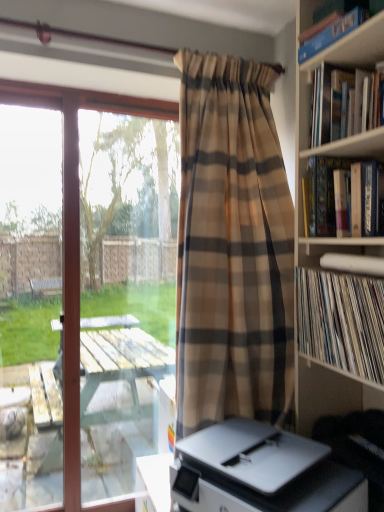
Question: Can you see transparent glass window at left touching white vinyl records at right, which is the first book in bottom-to-top order?

Choices:
 (A) yes
 (B) no

Answer: (B)

Question: Can you confirm if transparent glass window at left is thinner than white vinyl records at right, marked as the 4th book in a top-to-bottom arrangement?

Choices:
 (A) yes
 (B) no

Answer: (A)

Question: From a real-world perspective, is transparent glass window at left located beneath white vinyl records at right, which is the first book in bottom-to-top order?

Choices:
 (A) yes
 (B) no

Answer: (A)

Question: From the image's perspective, is transparent glass window at left over white vinyl records at right, which is the first book in bottom-to-top order?

Choices:
 (A) no
 (B) yes

Answer: (A)

Question: From a real-world perspective, is transparent glass window at left on white vinyl records at right, which is the first book in bottom-to-top order?

Choices:
 (A) no
 (B) yes

Answer: (A)

Question: From the image's perspective, is blue hardcover book at upper right, the 1th book positioned from the top, located above or below white vinyl records at right, marked as the 4th book in a top-to-bottom arrangement?

Choices:
 (A) above
 (B) below

Answer: (A)

Question: In terms of width, does blue hardcover book at upper right, the 1th book positioned from the top, look wider or thinner when compared to white vinyl records at right, marked as the 4th book in a top-to-bottom arrangement?

Choices:
 (A) thin
 (B) wide

Answer: (A)

Question: Considering the positions of blue hardcover book at upper right, which is counted as the fourth book, starting from the bottom, and white vinyl records at right, which is the first book in bottom-to-top order, in the image, is blue hardcover book at upper right, which is counted as the fourth book, starting from the bottom, bigger or smaller than white vinyl records at right, which is the first book in bottom-to-top order,?

Choices:
 (A) big
 (B) small

Answer: (B)

Question: Which is correct: blue hardcover book at upper right, which is counted as the fourth book, starting from the bottom, is inside white vinyl records at right, marked as the 4th book in a top-to-bottom arrangement, or outside of it?

Choices:
 (A) outside
 (B) inside

Answer: (A)

Question: Does point (370, 285) appear closer or farther from the camera than point (357, 23)?

Choices:
 (A) farther
 (B) closer

Answer: (B)

Question: Considering their positions, is white vinyl records at right, marked as the 4th book in a top-to-bottom arrangement, located in front of or behind blue hardcover book at upper right, the 1th book positioned from the top?

Choices:
 (A) front
 (B) behind

Answer: (A)

Question: Considering the positions of white vinyl records at right, which is the first book in bottom-to-top order, and blue hardcover book at upper right, which is counted as the fourth book, starting from the bottom, in the image, is white vinyl records at right, which is the first book in bottom-to-top order, taller or shorter than blue hardcover book at upper right, which is counted as the fourth book, starting from the bottom,?

Choices:
 (A) short
 (B) tall

Answer: (B)

Question: From a real-world perspective, is white vinyl records at right, marked as the 4th book in a top-to-bottom arrangement, physically located above or below blue hardcover book at upper right, which is counted as the fourth book, starting from the bottom?

Choices:
 (A) above
 (B) below

Answer: (B)

Question: Considering the positions of white vinyl records at right, which is the first book in bottom-to-top order, and hardcover book at upper right, acting as the 3th book starting from the bottom, in the image, is white vinyl records at right, which is the first book in bottom-to-top order, taller or shorter than hardcover book at upper right, acting as the 3th book starting from the bottom,?

Choices:
 (A) tall
 (B) short

Answer: (A)

Question: Considering the positions of point (352, 302) and point (357, 94), is point (352, 302) closer or farther from the camera than point (357, 94)?

Choices:
 (A) closer
 (B) farther

Answer: (A)